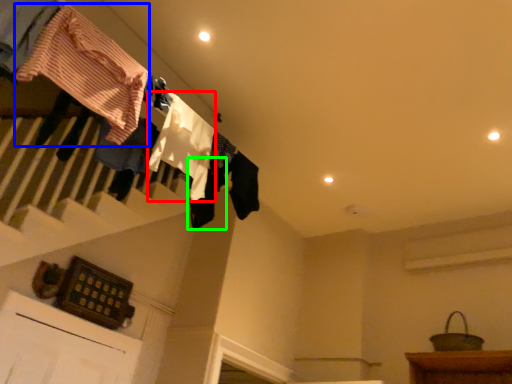
Question: Based on their relative distances, which object is nearer to clothing (highlighted by a red box)? Choose from clothing (highlighted by a blue box) and clothing (highlighted by a green box).

Choices:
 (A) clothing
 (B) clothing

Answer: (B)